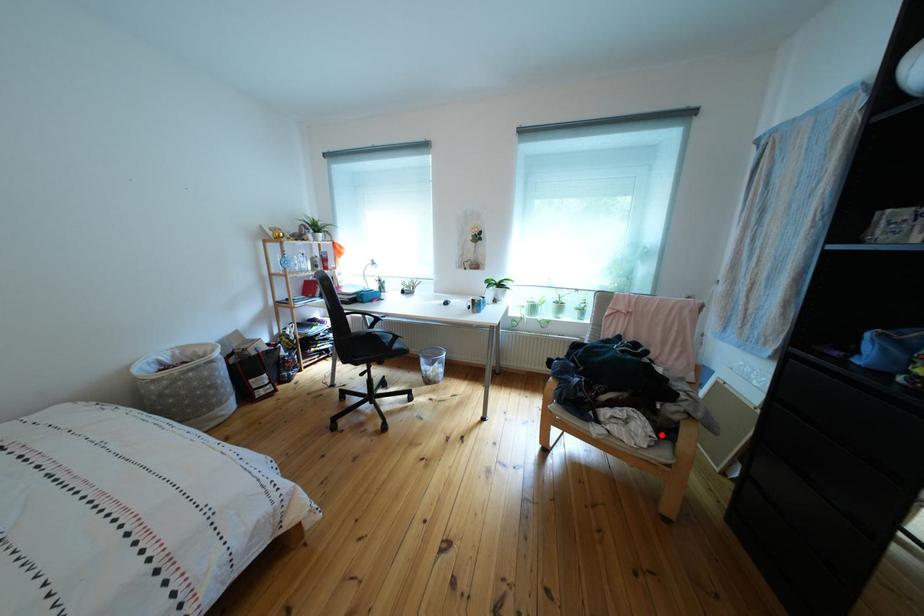
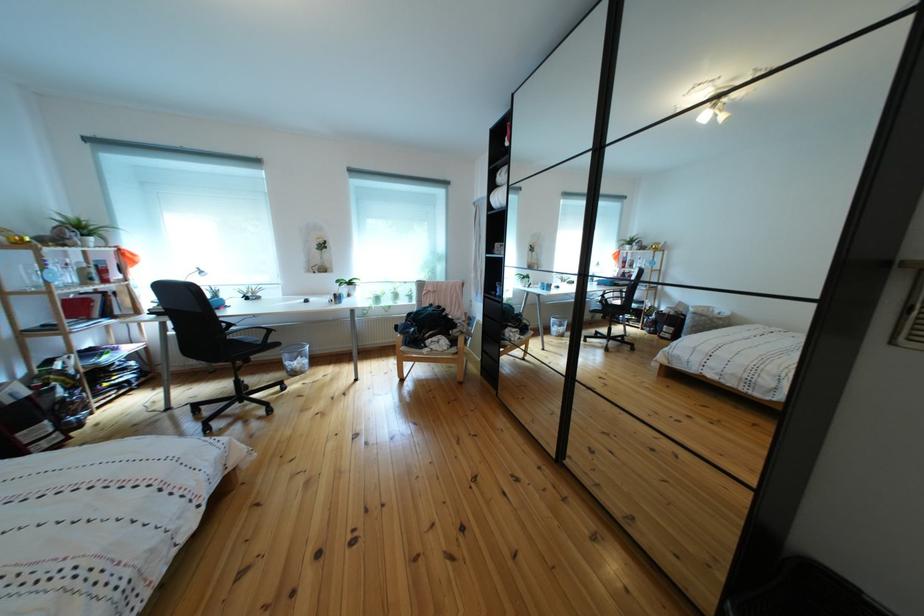
Where in the second image is the point corresponding to the highlighted location from the first image?

(458, 347)